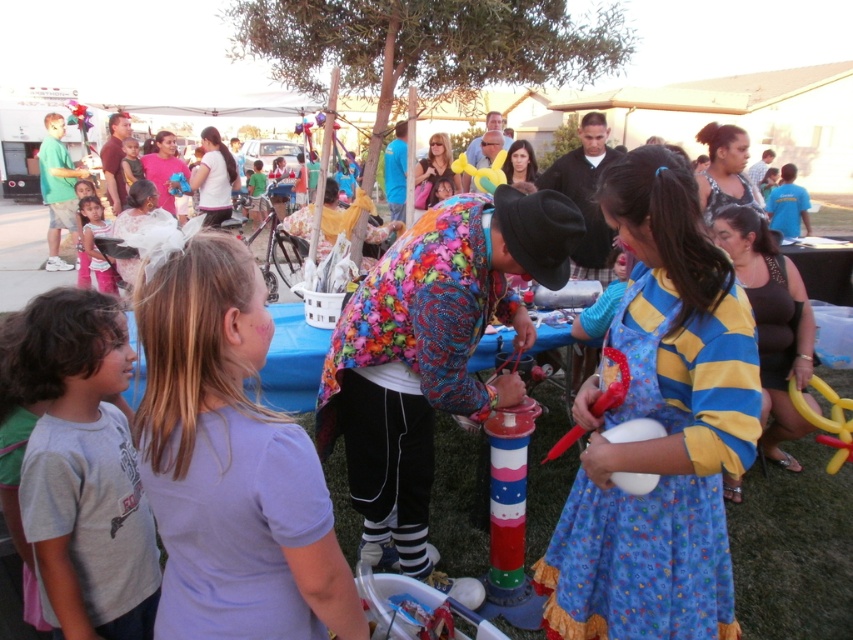
Question: Does black jersey dress at center appear over metallic silver balloon at center?

Choices:
 (A) no
 (B) yes

Answer: (B)

Question: Does gray cotton shirt at lower left have a larger size compared to white matte balloon at lower center?

Choices:
 (A) no
 (B) yes

Answer: (B)

Question: Can you confirm if gray cotton shirt at lower left is thinner than yellow rubber balloon animal at lower right?

Choices:
 (A) no
 (B) yes

Answer: (A)

Question: Among these points, which one is farthest from the camera?

Choices:
 (A) click(x=646, y=332)
 (B) click(x=90, y=252)
 (C) click(x=151, y=627)

Answer: (B)

Question: Which object is the farthest from the blue cotton dress at center?

Choices:
 (A) matte pink dress at lower left
 (B) black jersey dress at center
 (C) yellow rubber balloon animal at lower right
 (D) purple cotton shirt at center

Answer: (A)

Question: Based on their relative distances, which object is farther from the matte pink dress at lower left?

Choices:
 (A) blue cotton dress at center
 (B) metallic silver balloon at center
 (C) yellow rubber balloon animal at lower right
 (D) yellow balloon at center

Answer: (C)